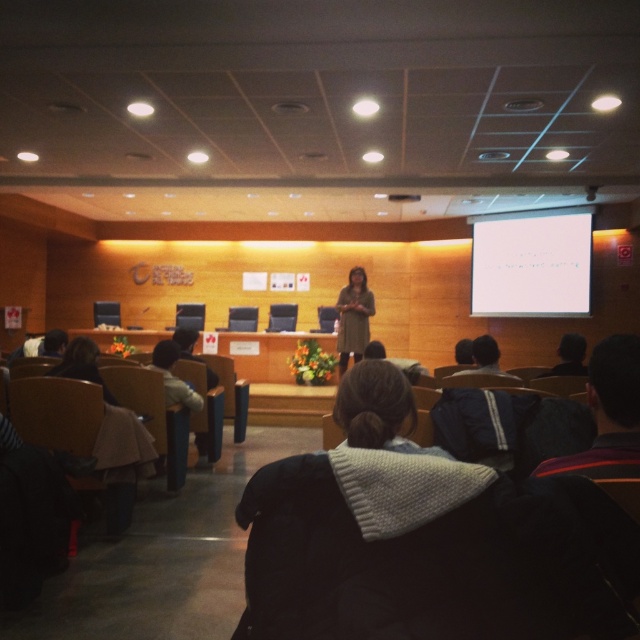
You are standing in the conference room and want to locate the white matte projection screen at upper center. According to the coordinates provided, where should you look?

You should look at point 0.412 on the x axis and 0.831 on the y axis to find the white matte projection screen at upper center.

You are an event organizer who needs to ensure accessibility for a guest in a wheelchair. The guest requires a seat that is lower to the ground. Which chair between the wooden chair at center and the smooth black chair at center would you recommend?

The smooth black chair at center is shorter in height compared to the wooden chair at center, so it would be more suitable for the guest in a wheelchair who needs a lower seat.